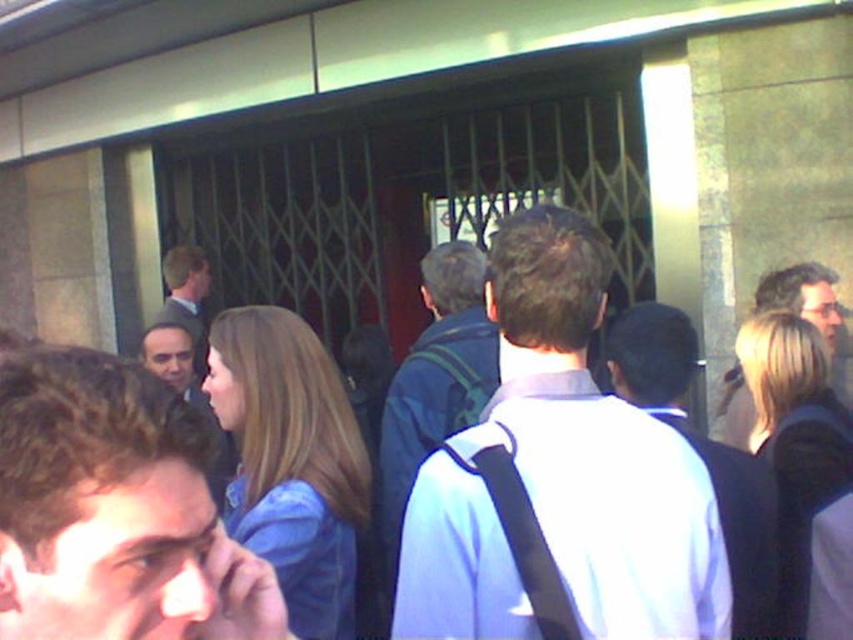
Question: Is blue fabric jacket at center positioned before white fabric shirt at center?

Choices:
 (A) yes
 (B) no

Answer: (A)

Question: Can you confirm if smooth skin face at center is positioned above matte black jacket at center?

Choices:
 (A) yes
 (B) no

Answer: (B)

Question: Can you confirm if blue fabric jacket at center is positioned to the right of matte black jacket at center?

Choices:
 (A) no
 (B) yes

Answer: (B)

Question: Which object is the farthest from the dark blue backpack at center?

Choices:
 (A) matte black jacket at center
 (B) blue fabric jacket at center
 (C) white fabric shirt at center

Answer: (A)

Question: Which point is farther to the camera?

Choices:
 (A) (96, 376)
 (B) (190, 380)
 (C) (781, 308)

Answer: (B)

Question: Considering the real-world distances, which object is closest to the light brown hair at center?

Choices:
 (A) matte black jacket at center
 (B) white matte shirt at center
 (C) smooth skin face at center
 (D) white fabric shirt at center

Answer: (D)